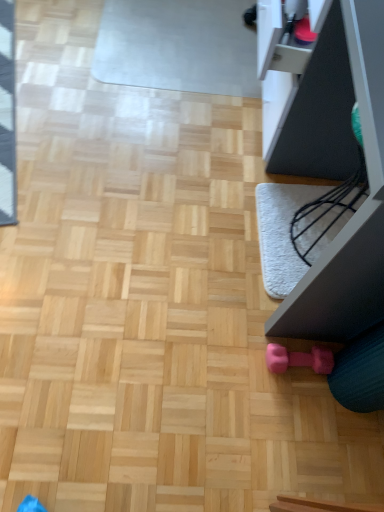
Question: In terms of height, does matte black monitor at right look taller or shorter compared to pink rubber dumbbell at lower right?

Choices:
 (A) short
 (B) tall

Answer: (B)

Question: From the image's perspective, is matte black monitor at right above or below pink rubber dumbbell at lower right?

Choices:
 (A) below
 (B) above

Answer: (B)

Question: Does point (359, 314) appear closer or farther from the camera than point (286, 356)?

Choices:
 (A) closer
 (B) farther

Answer: (A)

Question: Is pink rubber dumbbell at lower right inside the boundaries of matte black monitor at right, or outside?

Choices:
 (A) outside
 (B) inside

Answer: (A)

Question: Considering the positions of pink rubber dumbbell at lower right and matte black monitor at right in the image, is pink rubber dumbbell at lower right taller or shorter than matte black monitor at right?

Choices:
 (A) short
 (B) tall

Answer: (A)

Question: Is pink rubber dumbbell at lower right in front of or behind matte black monitor at right in the image?

Choices:
 (A) front
 (B) behind

Answer: (B)

Question: Based on their sizes in the image, would you say pink rubber dumbbell at lower right is bigger or smaller than matte black monitor at right?

Choices:
 (A) big
 (B) small

Answer: (B)